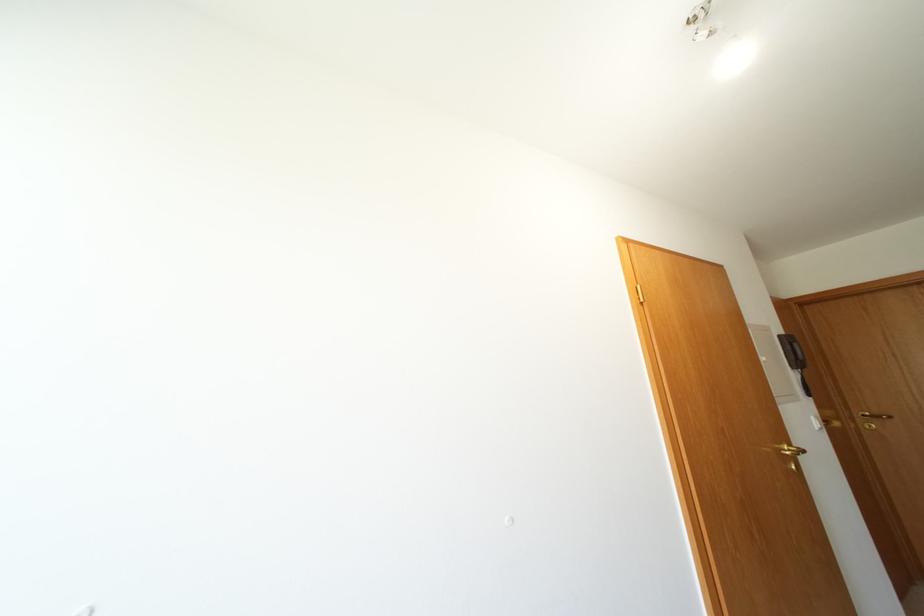
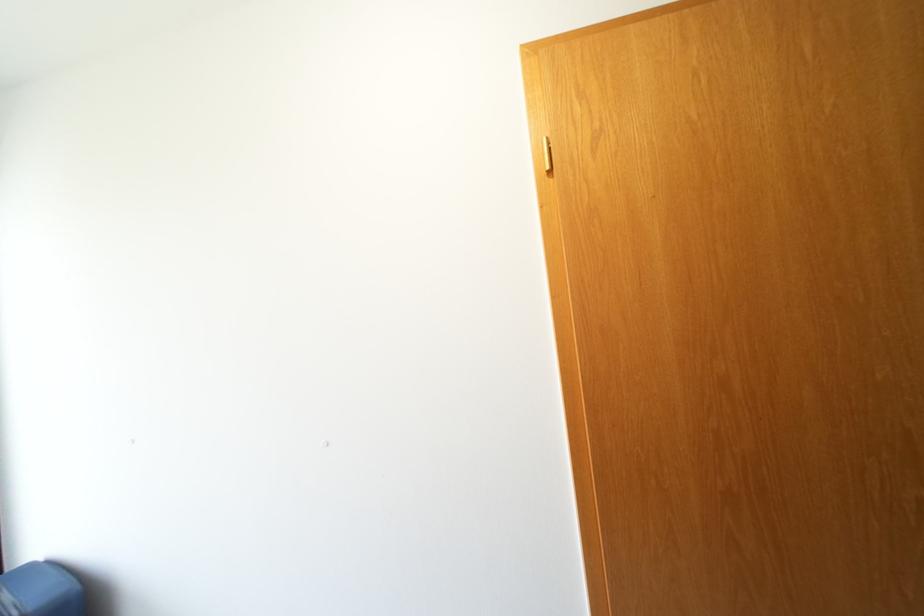
Question: The images are taken continuously from a first-person perspective. In which direction is your viewpoint rotating?

Choices:
 (A) Left
 (B) Right
 (C) Up
 (D) Down

Answer: (A)